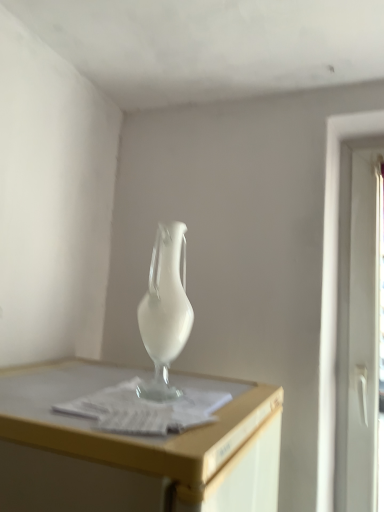
What do you see at coordinates (145, 409) in the screenshot? This screenshot has height=512, width=384. I see `white paper at center` at bounding box center [145, 409].

I want to click on satin white vase at center, so click(x=165, y=310).

Identify the location of white plastic screen door at right. (358, 326).

Between point (187, 308) and point (352, 494), which one is positioned in front?

The point (187, 308) is more forward.

Which object is thinner, satin white vase at center or white plastic screen door at right?

white plastic screen door at right is thinner.

Would you say satin white vase at center is to the left or to the right of white plastic screen door at right in the picture?

From the image, it's evident that satin white vase at center is to the left of white plastic screen door at right.

I want to click on screen door behind the satin white vase at center, so click(358, 326).

From a real-world perspective, is white plastic screen door at right physically located above or below satin white vase at center?

From a real-world perspective, white plastic screen door at right is physically below satin white vase at center.

Between white plastic screen door at right and satin white vase at center, which one has larger width?

Wider between the two is satin white vase at center.

How many degrees apart are the facing directions of white plastic screen door at right and white paper at center?

92.1 degrees separate the facing orientations of white plastic screen door at right and white paper at center.

Is white plastic screen door at right thinner than white paper at center?

Yes.

Considering the sizes of objects white plastic screen door at right and white paper at center in the image provided, who is bigger, white plastic screen door at right or white paper at center?

white plastic screen door at right is bigger.

Which is more to the right, white plastic screen door at right or white paper at center?

white plastic screen door at right.

Considering the sizes of white paper at center and satin white vase at center in the image, is white paper at center bigger or smaller than satin white vase at center?

Considering their sizes, white paper at center takes up less space than satin white vase at center.

From the image's perspective, is white paper at center above or below satin white vase at center?

white paper at center is below satin white vase at center.

Would you say white paper at center is inside or outside satin white vase at center?

white paper at center lies outside satin white vase at center.

Between white paper at center and satin white vase at center, which one has less height?

With less height is white paper at center.

Is white paper at center positioned far away from white plastic screen door at right?

That's not correct — white paper at center is a little close to white plastic screen door at right.

Does white paper at center have a smaller size compared to white plastic screen door at right?

Yes.

Is point (137, 407) closer or farther from the camera than point (357, 331)?

Point (137, 407) is positioned closer to the camera compared to point (357, 331).

Is white paper at center spatially inside white plastic screen door at right, or outside of it?

white paper at center is not enclosed by white plastic screen door at right.

Between satin white vase at center and white paper at center, which one has larger size?

satin white vase at center is bigger.

Can you confirm if satin white vase at center is taller than white paper at center?

Yes, satin white vase at center is taller than white paper at center.

Measure the distance between satin white vase at center and white paper at center.

satin white vase at center is 11.42 centimeters from white paper at center.

Who is more distant, satin white vase at center or white paper at center?

satin white vase at center.

You are a GUI agent. You are given a task and a screenshot of the screen. Output one action in this format:
    pyautogui.click(x=<x>, y=<y>)
    Task: Click on the vase in front of the white plastic screen door at right
    The width and height of the screenshot is (384, 512).
    Given the screenshot: What is the action you would take?
    pyautogui.click(x=165, y=310)

This screenshot has width=384, height=512. Identify the location of screen door behind the satin white vase at center. (358, 326).

Based on their spatial positions, is satin white vase at center or white paper at center closer to white plastic screen door at right?

satin white vase at center is positioned closer to the anchor white plastic screen door at right.

Based on their spatial positions, is white paper at center or white plastic screen door at right further from satin white vase at center?

The object further to satin white vase at center is white plastic screen door at right.

Estimate the real-world distances between objects in this image. Which object is further from white paper at center, white plastic screen door at right or satin white vase at center?

Based on the image, white plastic screen door at right appears to be further to white paper at center.

Which object lies nearer to the anchor point white plastic screen door at right, white paper at center or satin white vase at center?

satin white vase at center.

Looking at the image, which one is located further to satin white vase at center, white plastic screen door at right or white paper at center?

The object further to satin white vase at center is white plastic screen door at right.

Estimate the real-world distances between objects in this image. Which object is further from white paper at center, satin white vase at center or white plastic screen door at right?

white plastic screen door at right.

Find the location of a particular element. The height and width of the screenshot is (512, 384). vase between white paper at center and white plastic screen door at right is located at coordinates (165, 310).